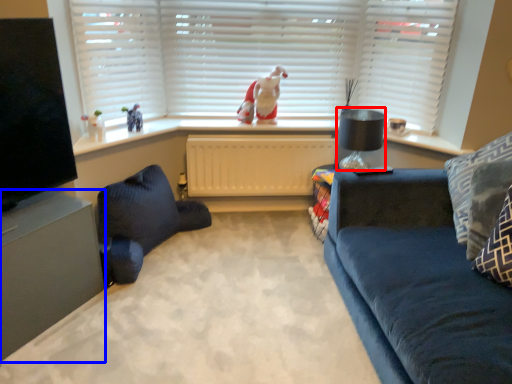
Question: Which point is further to the camera, lamp (highlighted by a red box) or entertainment center (highlighted by a blue box)?

Choices:
 (A) lamp
 (B) entertainment center

Answer: (A)